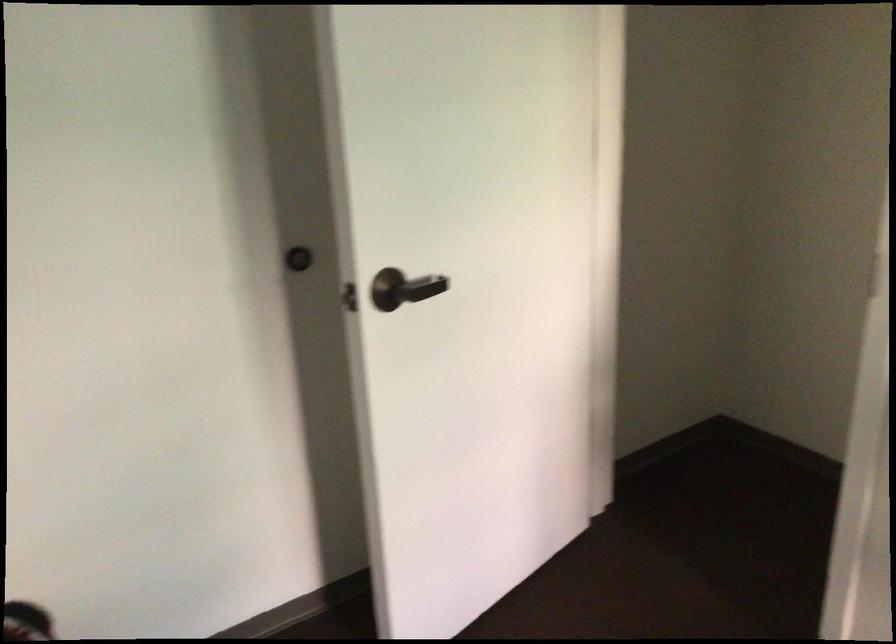
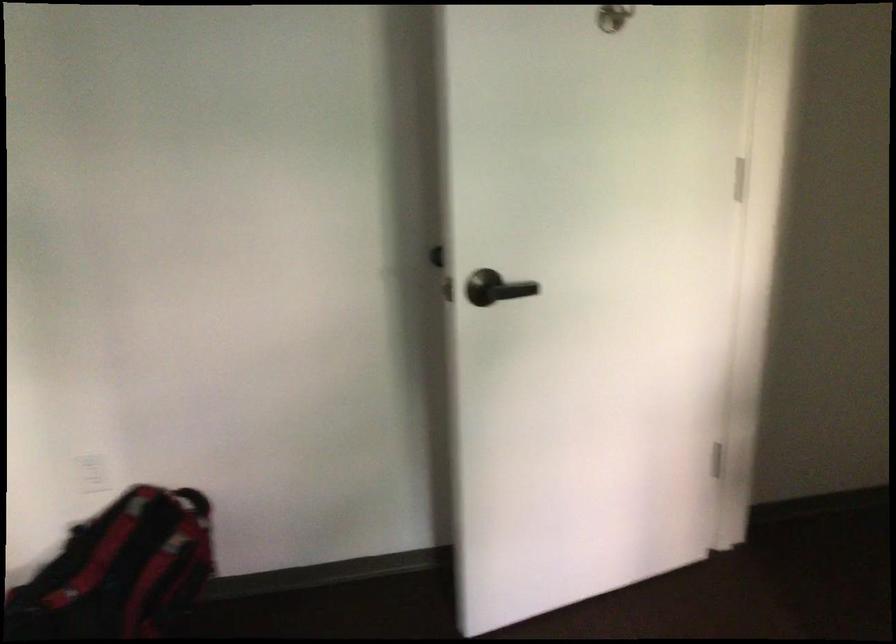
In the second image, find the point that corresponds to point (406, 287) in the first image.

(495, 288)